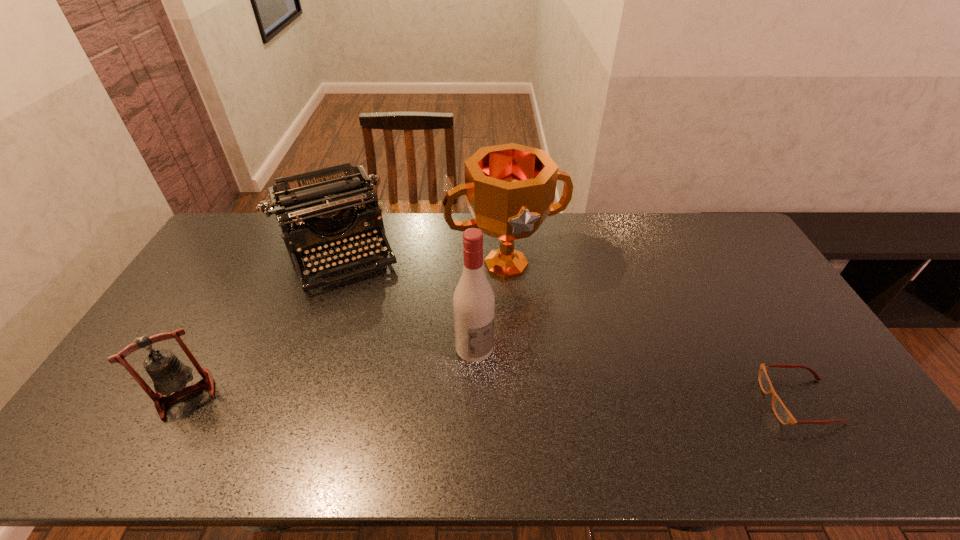
Where is `bell`? bell is located at coordinates (168, 373).

At what (x,y) coordinates should I click in order to perform the action: click on the rightmost object. Please return your answer as a coordinate pair (x, y). Looking at the image, I should click on (782, 413).

Identify the location of the shortest object. Image resolution: width=960 pixels, height=540 pixels. (782, 413).

At what (x,y) coordinates should I click in order to perform the action: click on typewriter. Please return your answer as a coordinate pair (x, y). The width and height of the screenshot is (960, 540). Looking at the image, I should click on (319, 201).

Where is `award`? The height and width of the screenshot is (540, 960). award is located at coordinates (510, 189).

I want to click on the third farthest object, so click(473, 301).

Identify the location of vacant region located on the back of the bell. The width and height of the screenshot is (960, 540). (245, 288).

This screenshot has width=960, height=540. What are the coordinates of `vacant region located on the front-facing side of the spectacles` in the screenshot? It's located at (625, 402).

The width and height of the screenshot is (960, 540). I want to click on vacant region located 0.230m on the front-facing side of the spectacles, so click(676, 402).

Identify the location of vacant space situated on the front-facing side of the spectacles. The width and height of the screenshot is (960, 540). (634, 402).